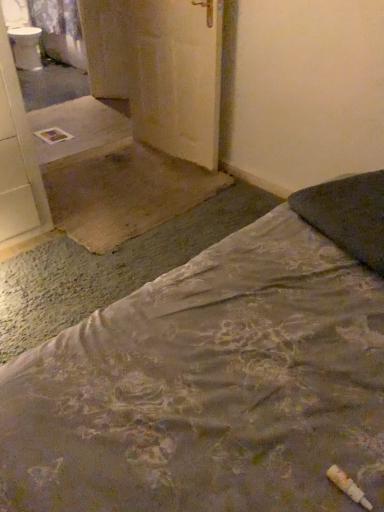
Question: Is matte yellow door at center not inside floral fabric bed at lower right?

Choices:
 (A) yes
 (B) no

Answer: (A)

Question: Is matte yellow door at center in contact with floral fabric bed at lower right?

Choices:
 (A) yes
 (B) no

Answer: (B)

Question: Does matte yellow door at center have a greater width compared to floral fabric bed at lower right?

Choices:
 (A) no
 (B) yes

Answer: (A)

Question: From the image's perspective, is matte yellow door at center located above floral fabric bed at lower right?

Choices:
 (A) no
 (B) yes

Answer: (B)

Question: Is matte yellow door at center further to camera compared to floral fabric bed at lower right?

Choices:
 (A) yes
 (B) no

Answer: (A)

Question: Is matte yellow door at center far away from floral fabric bed at lower right?

Choices:
 (A) no
 (B) yes

Answer: (B)

Question: Is dark gray fabric pillow at upper right facing away from matte yellow door at center?

Choices:
 (A) no
 (B) yes

Answer: (A)

Question: Could matte yellow door at center be considered to be inside dark gray fabric pillow at upper right?

Choices:
 (A) yes
 (B) no

Answer: (B)

Question: Does dark gray fabric pillow at upper right have a lesser width compared to matte yellow door at center?

Choices:
 (A) yes
 (B) no

Answer: (B)

Question: Are dark gray fabric pillow at upper right and matte yellow door at center making contact?

Choices:
 (A) yes
 (B) no

Answer: (B)

Question: Considering the relative positions of dark gray fabric pillow at upper right and matte yellow door at center in the image provided, is dark gray fabric pillow at upper right to the right of matte yellow door at center from the viewer's perspective?

Choices:
 (A) yes
 (B) no

Answer: (A)

Question: Is dark gray fabric pillow at upper right not near matte yellow door at center?

Choices:
 (A) yes
 (B) no

Answer: (A)

Question: Is floral fabric bed at lower right at the back of white glossy sink at upper left?

Choices:
 (A) yes
 (B) no

Answer: (B)